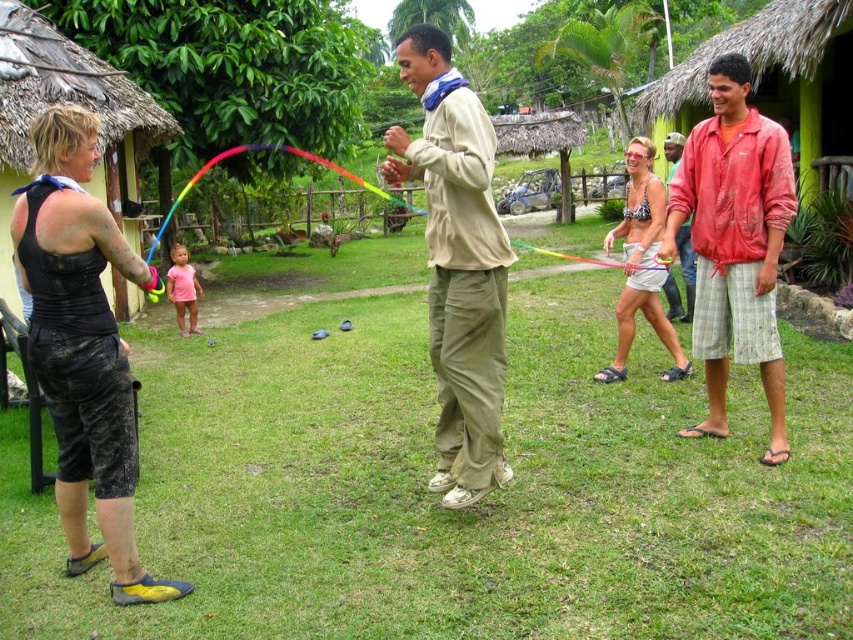
In the scene shown: Is printed bikini top at center closer to camera compared to red fabric shirt at right?

Yes, printed bikini top at center is in front of red fabric shirt at right.

Between point (625, 160) and point (683, 268), which one is positioned in front?

Point (683, 268)

Find the location of `printed bikini top at center`. printed bikini top at center is located at coordinates (641, 264).

From the picture: Does red cotton shirt at right appear over rainbow plastic kite at center?

Actually, red cotton shirt at right is below rainbow plastic kite at center.

Can you confirm if red cotton shirt at right is shorter than rainbow plastic kite at center?

Yes.

Who is more distant from viewer, (756,349) or (265,145)?

Positioned behind is point (265,145).

Locate an element on the screen. red cotton shirt at right is located at coordinates (734, 243).

Can you confirm if black matte shorts at left is taller than rainbow plastic kite at center?

In fact, black matte shorts at left may be shorter than rainbow plastic kite at center.

This screenshot has width=853, height=640. I want to click on black matte shorts at left, so click(x=83, y=348).